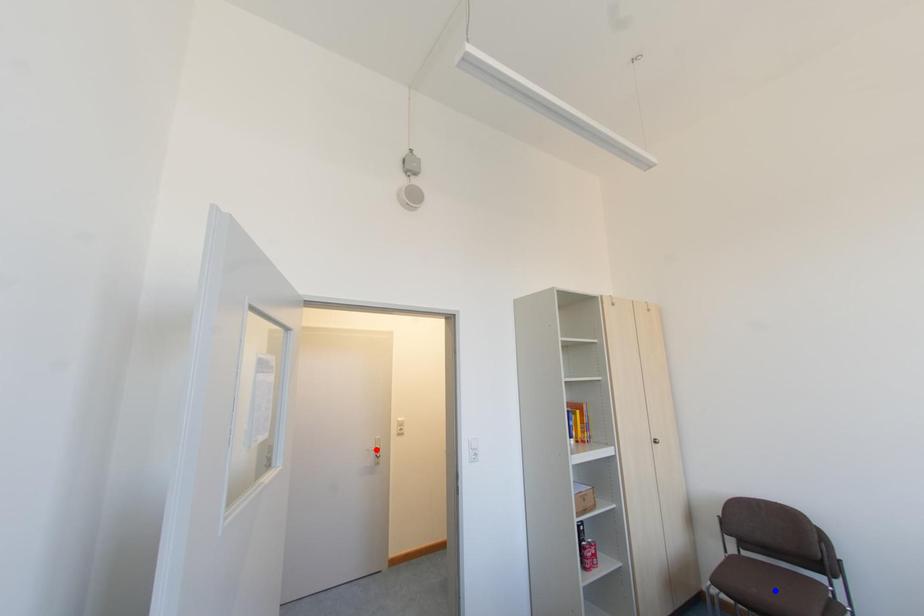
Question: Two points are marked on the image. Which point is closer to the camera?

Choices:
 (A) Blue point is closer.
 (B) Red point is closer.

Answer: (A)